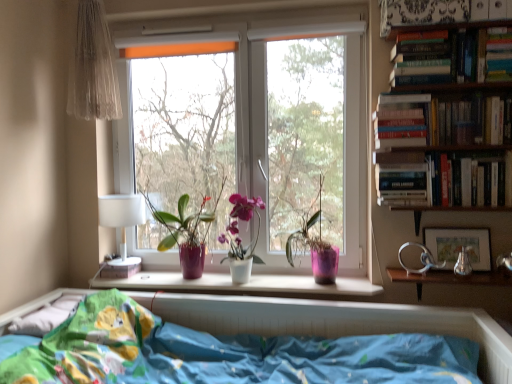
This screenshot has width=512, height=384. Find the location of `free point above green leafy tree at center (from a real-world perspective)`. free point above green leafy tree at center (from a real-world perspective) is located at coordinates (176, 35).